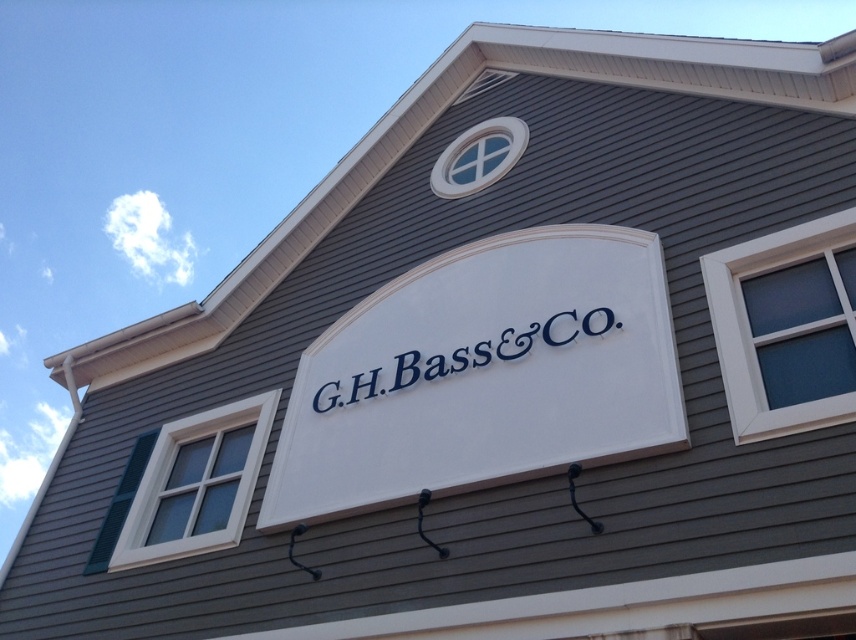
Which is more to the left, white matte sign at center or white painted signboard at center?

white matte sign at center is more to the left.

Who is higher up, white matte sign at center or white painted signboard at center?

white painted signboard at center

Does point (311, 346) lie in front of point (385, 374)?

No, it is not.

At what (x,y) coordinates should I click in order to perform the action: click on white matte sign at center. Please return your answer as a coordinate pair (x, y). Image resolution: width=856 pixels, height=640 pixels. Looking at the image, I should click on (483, 374).